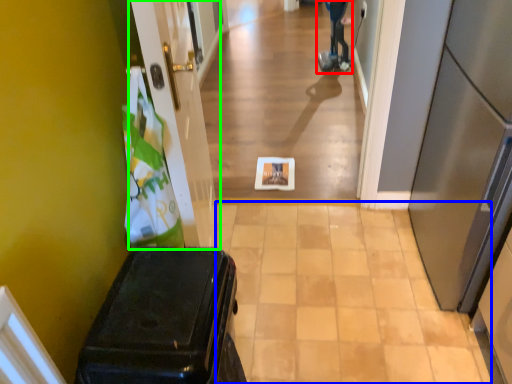
Question: Which is farther away from mobility scooter (highlighted by a red box)? path (highlighted by a blue box) or door (highlighted by a green box)?

Choices:
 (A) path
 (B) door

Answer: (A)